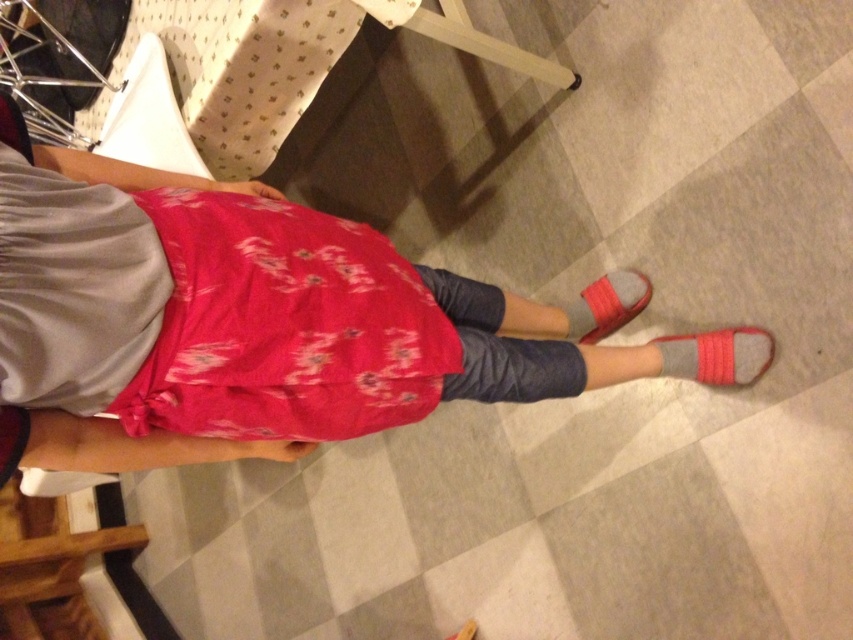
You are a fashion designer observing the person in the image. You notice both the gray suede sock at lower right and the gray suede sandal at lower right. Which one has a larger size?

The gray suede sock at lower right is bigger than the gray suede sandal at lower right according to the description.

You are a photographer setting up a shoot in this room. You need to position a small prop between the floral fabric skirt at center and the gray suede sandal at lower right. Where should you place it so it is equidistant from both objects?

Place the prop halfway between the floral fabric skirt at center and the gray suede sandal at lower right. Since the floral fabric skirt at center is closer to the viewer than the gray suede sandal at lower right, positioning it midway will ensure equal distance from both objects.

You are trying to decide which item to pick up first. The floral fabric skirt at center is much taller than the gray suede sock at lower right. Which item is closer to your eye level?

The floral fabric skirt at center is closer to your eye level because it is much taller than the gray suede sock at lower right.